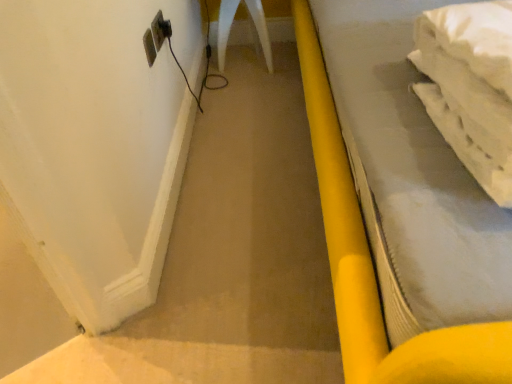
What is the approximate width of black plastic plug at upper left?

black plastic plug at upper left is 1.04 inches wide.

What do you see at coordinates (165, 28) in the screenshot? I see `black plastic plug at upper left` at bounding box center [165, 28].

Describe the element at coordinates (158, 31) in the screenshot. The width and height of the screenshot is (512, 384). I see `white plastic electric outlet at upper left` at that location.

This screenshot has height=384, width=512. I want to click on black plastic plug at upper left, so click(x=165, y=28).

From a real-world perspective, is yellow plastic bed at right on top of white plastic electric outlet at upper left?

Incorrect, from a real-world perspective, yellow plastic bed at right is lower than white plastic electric outlet at upper left.

Is yellow plastic bed at right completely or partially outside of white plastic electric outlet at upper left?

yellow plastic bed at right lies outside white plastic electric outlet at upper left's area.

Which of these two, yellow plastic bed at right or white plastic electric outlet at upper left, is thinner?

white plastic electric outlet at upper left is thinner.

Which object is positioned more to the right, yellow plastic bed at right or white plastic electric outlet at upper left?

yellow plastic bed at right is more to the right.

Which is in front, point (162, 24) or point (358, 300)?

The point (358, 300) is closer.

Is black plastic plug at upper left smaller than yellow plastic bed at right?

Yes, black plastic plug at upper left is smaller than yellow plastic bed at right.

Is black plastic plug at upper left placed right next to yellow plastic bed at right?

No, black plastic plug at upper left is not beside yellow plastic bed at right.

Is yellow plastic bed at right surrounded by black plastic plug at upper left?

No, yellow plastic bed at right is located outside of black plastic plug at upper left.

Is yellow plastic bed at right next to black plastic plug at upper left?

No.

From the image's perspective, is yellow plastic bed at right above or below black plastic plug at upper left?

yellow plastic bed at right is below black plastic plug at upper left.

Is black plastic plug at upper left located within yellow plastic bed at right?

No, yellow plastic bed at right does not contain black plastic plug at upper left.

Locate an element on the screen. The width and height of the screenshot is (512, 384). plug above the yellow plastic bed at right (from the image's perspective) is located at coordinates (165, 28).

Looking at this image, in terms of height, does white plastic electric outlet at upper left look taller or shorter compared to yellow plastic bed at right?

Considering their sizes, white plastic electric outlet at upper left has less height than yellow plastic bed at right.

From the image's perspective, which is below, white plastic electric outlet at upper left or yellow plastic bed at right?

From the image's view, yellow plastic bed at right is below.

How different are the orientations of white plastic electric outlet at upper left and yellow plastic bed at right in degrees?

86.3 degrees.

Would you say white plastic electric outlet at upper left is to the left or to the right of yellow plastic bed at right in the picture?

white plastic electric outlet at upper left is positioned on yellow plastic bed at right's left side.

Considering the points (160, 31) and (170, 33), which point is in front, point (160, 31) or point (170, 33)?

Positioned in front is point (160, 31).

Is white plastic electric outlet at upper left beside black plastic plug at upper left?

Yes, white plastic electric outlet at upper left is beside black plastic plug at upper left.

I want to click on electric outlet that is in front of the black plastic plug at upper left, so click(158, 31).

Which object is positioned more to the right, black plastic plug at upper left or white plastic electric outlet at upper left?

From the viewer's perspective, black plastic plug at upper left appears more on the right side.

From a real-world perspective, does black plastic plug at upper left stand above white plastic electric outlet at upper left?

No, from a real-world perspective, black plastic plug at upper left is not above white plastic electric outlet at upper left.

Image resolution: width=512 pixels, height=384 pixels. In order to click on electric outlet that is in front of the black plastic plug at upper left in this screenshot , I will do `click(158, 31)`.

At what (x,y) coordinates should I click in order to perform the action: click on electric outlet above the yellow plastic bed at right (from a real-world perspective). Please return your answer as a coordinate pair (x, y). The width and height of the screenshot is (512, 384). Looking at the image, I should click on (158, 31).

In order to click on furniture in front of the black plastic plug at upper left in this screenshot , I will do `click(372, 267)`.

Estimate the real-world distances between objects in this image. Which object is closer to black plastic plug at upper left, yellow plastic bed at right or white plastic electric outlet at upper left?

white plastic electric outlet at upper left is positioned closer to the anchor black plastic plug at upper left.

Which object lies nearer to the anchor point yellow plastic bed at right, white plastic electric outlet at upper left or black plastic plug at upper left?

white plastic electric outlet at upper left.

Estimate the real-world distances between objects in this image. Which object is further from black plastic plug at upper left, white plastic electric outlet at upper left or yellow plastic bed at right?

Among the two, yellow plastic bed at right is located further to black plastic plug at upper left.

Estimate the real-world distances between objects in this image. Which object is further from white plastic electric outlet at upper left, yellow plastic bed at right or black plastic plug at upper left?

yellow plastic bed at right lies further to white plastic electric outlet at upper left than the other object.

Considering their positions, is black plastic plug at upper left positioned further to yellow plastic bed at right than white plastic electric outlet at upper left?

black plastic plug at upper left.

Looking at the image, which one is located further to white plastic electric outlet at upper left, black plastic plug at upper left or yellow plastic bed at right?

yellow plastic bed at right lies further to white plastic electric outlet at upper left than the other object.

Find the location of a particular element. electric outlet located between yellow plastic bed at right and black plastic plug at upper left in the depth direction is located at coordinates (158, 31).